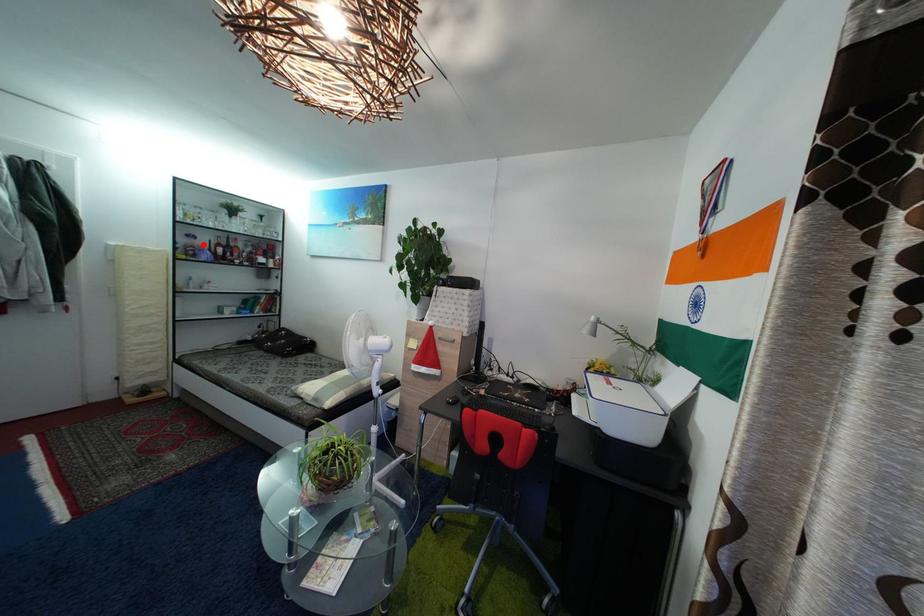
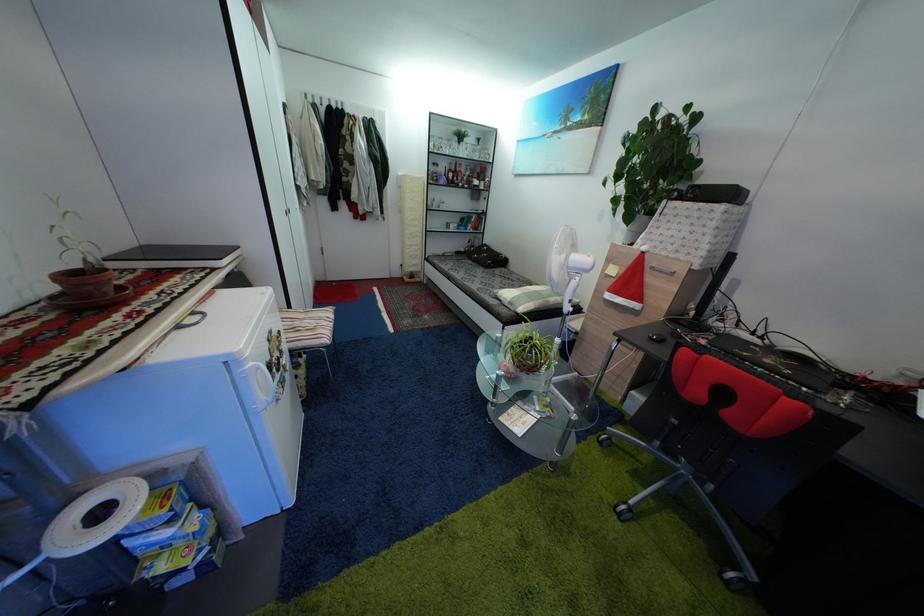
The point at the highlighted location is marked in the first image. Where is the corresponding point in the second image?

(445, 172)